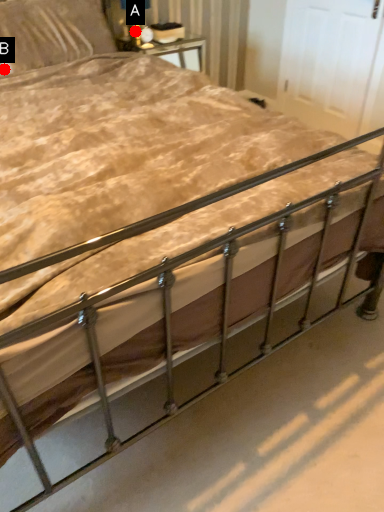
Question: Two points are circled on the image, labeled by A and B beside each circle. Which point is closer to the camera?

Choices:
 (A) A is closer
 (B) B is closer

Answer: (B)